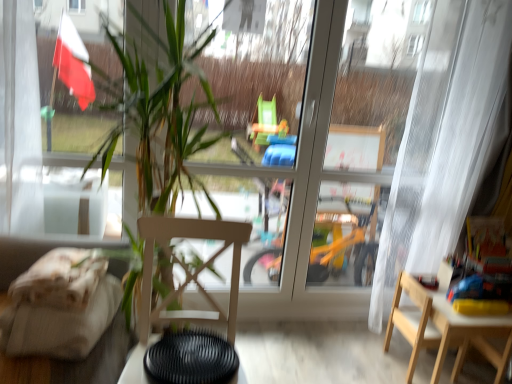
Question: Which direction should I rotate to look at wooden chair at center, marked as the first chair in a left-to-right arrangement?

Choices:
 (A) left
 (B) right

Answer: (A)

Question: Can you confirm if wooden chair at center, marked as the first chair in a left-to-right arrangement, is wider than black matte table at lower center, which is counted as the second table, starting from the back?

Choices:
 (A) yes
 (B) no

Answer: (A)

Question: Considering the relative sizes of wooden chair at center, which is counted as the second chair, starting from the right, and black matte table at lower center, which is counted as the second table, starting from the right, in the image provided, is wooden chair at center, which is counted as the second chair, starting from the right, taller than black matte table at lower center, which is counted as the second table, starting from the right,?

Choices:
 (A) yes
 (B) no

Answer: (A)

Question: Considering the relative positions of wooden chair at center, which is counted as the second chair, starting from the right, and black matte table at lower center, which is counted as the second table, starting from the right, in the image provided, is wooden chair at center, which is counted as the second chair, starting from the right, in front of black matte table at lower center, which is counted as the second table, starting from the right,?

Choices:
 (A) yes
 (B) no

Answer: (A)

Question: From the image's perspective, is wooden chair at center, marked as the first chair in a left-to-right arrangement, on black matte table at lower center, positioned as the first table in front-to-back order?

Choices:
 (A) yes
 (B) no

Answer: (A)

Question: Is wooden chair at center, acting as the first chair starting from the front, to the right of black matte table at lower center, arranged as the 1th table when viewed from the left, from the viewer's perspective?

Choices:
 (A) no
 (B) yes

Answer: (A)

Question: Considering the relative positions of wooden chair at center, placed as the second chair when sorted from back to front, and black matte table at lower center, positioned as the first table in front-to-back order, in the image provided, is wooden chair at center, placed as the second chair when sorted from back to front, to the left of black matte table at lower center, positioned as the first table in front-to-back order, from the viewer's perspective?

Choices:
 (A) no
 (B) yes

Answer: (B)

Question: Is wooden table at lower right, positioned as the first table in right-to-left order, shorter than white sheer curtain at right?

Choices:
 (A) yes
 (B) no

Answer: (A)

Question: Does wooden table at lower right, placed as the 2th table when sorted from front to back, have a larger size compared to white sheer curtain at right?

Choices:
 (A) yes
 (B) no

Answer: (B)

Question: Does wooden table at lower right, which appears as the second table when viewed from the left, appear on the right side of white sheer curtain at right?

Choices:
 (A) yes
 (B) no

Answer: (A)

Question: From a real-world perspective, does wooden table at lower right, placed as the 2th table when sorted from front to back, sit lower than white sheer curtain at right?

Choices:
 (A) yes
 (B) no

Answer: (A)

Question: Can you confirm if wooden table at lower right, positioned as the first table in right-to-left order, is thinner than white sheer curtain at right?

Choices:
 (A) no
 (B) yes

Answer: (A)

Question: Can you confirm if beige fabric couch at left is positioned to the left of wooden chair at center, which is counted as the second chair, starting from the right?

Choices:
 (A) no
 (B) yes

Answer: (B)